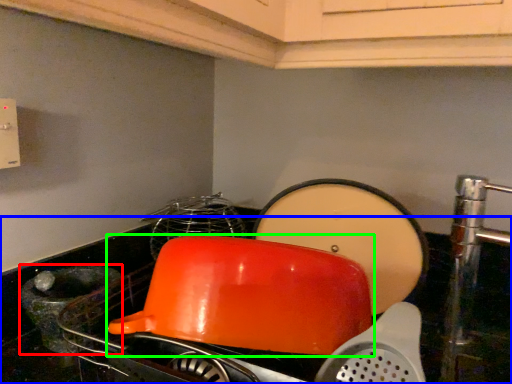
Question: Which object is the farthest from appliance (highlighted by a red box)? Choose among these: counter top (highlighted by a blue box) or kitchen appliance (highlighted by a green box).

Choices:
 (A) counter top
 (B) kitchen appliance

Answer: (B)